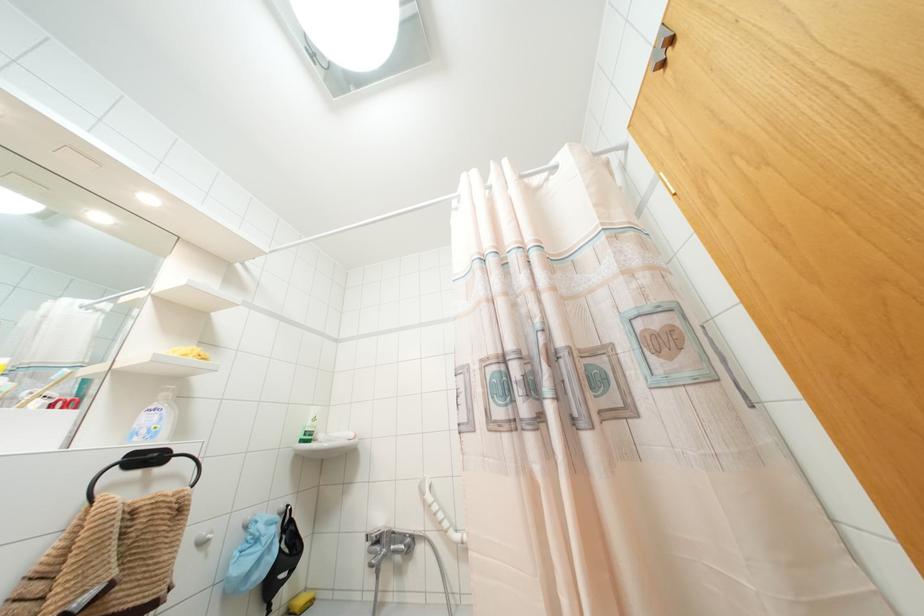
You are a GUI agent. You are given a task and a screenshot of the screen. Output one action in this format:
    pyautogui.click(x=<x>, y=<y>)
    Task: Click on the shower faucet lever
    
    Given the screenshot: What is the action you would take?
    pyautogui.click(x=380, y=535)